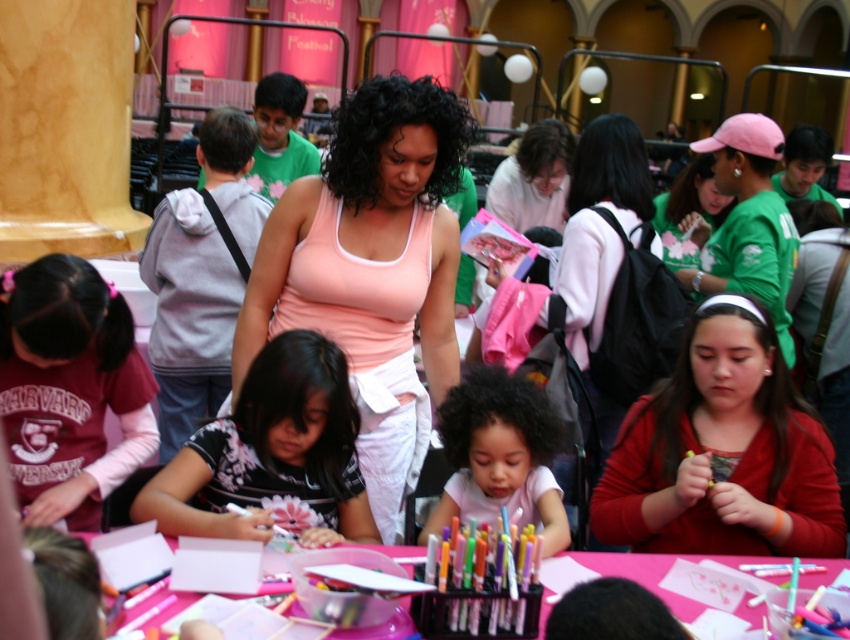
You are at the event and want to find the person wearing the smooth pink shirt at center. Which direction should you look relative to the matte pink tank top at center?

The smooth pink shirt at center is below the matte pink tank top at center, so look downward from the matte pink tank top at center to locate it.

You are at the event and want to take a photo of the point at coordinates point (94,460). The camera you are using has a maximum focus range of 10 feet. Will you be able to capture the point clearly?

The point (94,460) is 12.09 feet away from the camera, which exceeds the maximum focus range of 10 feet. Therefore, you will not be able to capture it clearly.